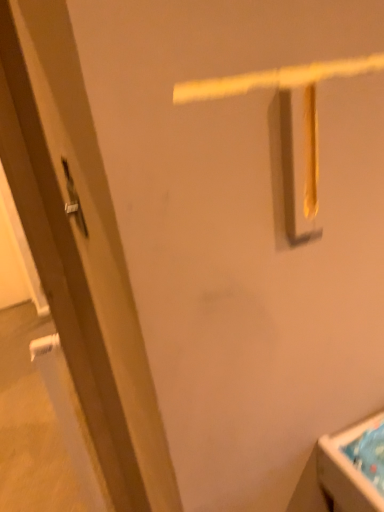
Question: Does satin silver door handle at left come in front of white glossy sink at lower right?

Choices:
 (A) no
 (B) yes

Answer: (A)

Question: Would you consider satin silver door handle at left to be distant from white glossy sink at lower right?

Choices:
 (A) no
 (B) yes

Answer: (A)

Question: Does satin silver door handle at left have a greater width compared to white glossy sink at lower right?

Choices:
 (A) yes
 (B) no

Answer: (B)

Question: Does satin silver door handle at left have a lesser height compared to white glossy sink at lower right?

Choices:
 (A) yes
 (B) no

Answer: (B)

Question: Is satin silver door handle at left taller than white glossy sink at lower right?

Choices:
 (A) no
 (B) yes

Answer: (B)

Question: In terms of width, does matte brown door at left look wider or thinner when compared to white glossy sink at lower right?

Choices:
 (A) wide
 (B) thin

Answer: (B)

Question: From a real-world perspective, is matte brown door at left positioned above or below white glossy sink at lower right?

Choices:
 (A) above
 (B) below

Answer: (A)

Question: From the image's perspective, is matte brown door at left located above or below white glossy sink at lower right?

Choices:
 (A) above
 (B) below

Answer: (A)

Question: Considering the positions of matte brown door at left and white glossy sink at lower right in the image, is matte brown door at left bigger or smaller than white glossy sink at lower right?

Choices:
 (A) small
 (B) big

Answer: (B)

Question: From the image's perspective, relative to satin silver door handle at left, is matte brown door at left above or below?

Choices:
 (A) below
 (B) above

Answer: (A)

Question: Considering the positions of point tap(99, 239) and point tap(79, 224), is point tap(99, 239) closer or farther from the camera than point tap(79, 224)?

Choices:
 (A) closer
 (B) farther

Answer: (A)

Question: Which is correct: matte brown door at left is inside satin silver door handle at left, or outside of it?

Choices:
 (A) inside
 (B) outside

Answer: (B)

Question: Is matte brown door at left taller or shorter than satin silver door handle at left?

Choices:
 (A) tall
 (B) short

Answer: (A)

Question: In terms of size, does white glossy sink at lower right appear bigger or smaller than matte brown door at left?

Choices:
 (A) small
 (B) big

Answer: (A)

Question: Choose the correct answer: Is white glossy sink at lower right inside matte brown door at left or outside it?

Choices:
 (A) outside
 (B) inside

Answer: (A)